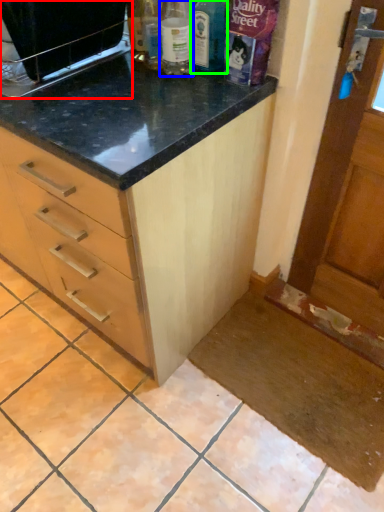
Question: Which object is the farthest from appliance (highlighted by a red box)? Choose among these: bottle (highlighted by a blue box) or bottle (highlighted by a green box).

Choices:
 (A) bottle
 (B) bottle

Answer: (B)